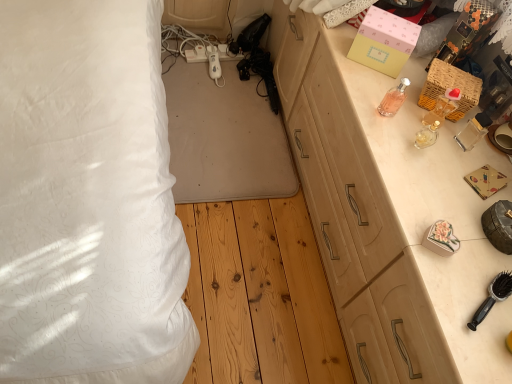
Question: Is pink glass bottle at upper right, the first perfume in the left-to-right sequence, at the left side of black plastic brush at lower right?

Choices:
 (A) no
 (B) yes

Answer: (B)

Question: Is pink glass bottle at upper right, positioned as the 3th perfume in right-to-left order, looking in the opposite direction of black plastic brush at lower right?

Choices:
 (A) no
 (B) yes

Answer: (A)

Question: Considering the relative positions of pink glass bottle at upper right, the first perfume in the left-to-right sequence, and black plastic brush at lower right in the image provided, is pink glass bottle at upper right, the first perfume in the left-to-right sequence, to the right of black plastic brush at lower right from the viewer's perspective?

Choices:
 (A) yes
 (B) no

Answer: (B)

Question: Considering the relative sizes of pink glass bottle at upper right, the first perfume in the left-to-right sequence, and black plastic brush at lower right in the image provided, is pink glass bottle at upper right, the first perfume in the left-to-right sequence, smaller than black plastic brush at lower right?

Choices:
 (A) no
 (B) yes

Answer: (B)

Question: Can you see pink glass bottle at upper right, positioned as the 3th perfume in right-to-left order, touching black plastic brush at lower right?

Choices:
 (A) yes
 (B) no

Answer: (B)

Question: In terms of width, does black plastic brush at lower right look wider or thinner when compared to woven wicker basket at upper right, which is the second box from left to right?

Choices:
 (A) thin
 (B) wide

Answer: (B)

Question: From a real-world perspective, is black plastic brush at lower right above or below woven wicker basket at upper right, the first box from the right?

Choices:
 (A) below
 (B) above

Answer: (A)

Question: Would you say black plastic brush at lower right is to the left or to the right of woven wicker basket at upper right, which is the second box from left to right, in the picture?

Choices:
 (A) right
 (B) left

Answer: (B)

Question: Considering the positions of black plastic brush at lower right and woven wicker basket at upper right, the first box from the right, in the image, is black plastic brush at lower right taller or shorter than woven wicker basket at upper right, the first box from the right,?

Choices:
 (A) short
 (B) tall

Answer: (A)

Question: Is pink matte box at upper right, placed as the first box when sorted from left to right, spatially inside black plastic brush at lower right, or outside of it?

Choices:
 (A) outside
 (B) inside

Answer: (A)

Question: Is pink matte box at upper right, arranged as the 2th box when viewed from the right, wider or thinner than black plastic brush at lower right?

Choices:
 (A) thin
 (B) wide

Answer: (A)

Question: Considering the positions of pink matte box at upper right, arranged as the 2th box when viewed from the right, and black plastic brush at lower right in the image, is pink matte box at upper right, arranged as the 2th box when viewed from the right, taller or shorter than black plastic brush at lower right?

Choices:
 (A) short
 (B) tall

Answer: (B)

Question: Would you say pink matte box at upper right, arranged as the 2th box when viewed from the right, is to the left or to the right of black plastic brush at lower right in the picture?

Choices:
 (A) right
 (B) left

Answer: (B)

Question: From their relative heights in the image, would you say woven wicker basket at upper right, which is the second box from left to right, is taller or shorter than pink glass bottle at upper right, positioned as the 3th perfume in right-to-left order?

Choices:
 (A) tall
 (B) short

Answer: (B)

Question: Which is correct: woven wicker basket at upper right, which is the second box from left to right, is inside pink glass bottle at upper right, positioned as the 3th perfume in right-to-left order, or outside of it?

Choices:
 (A) inside
 (B) outside

Answer: (B)